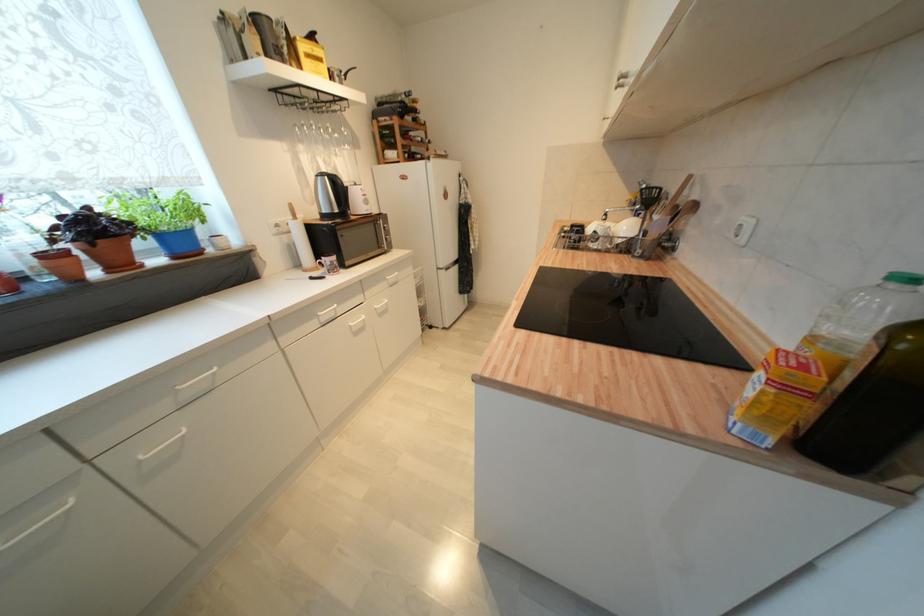
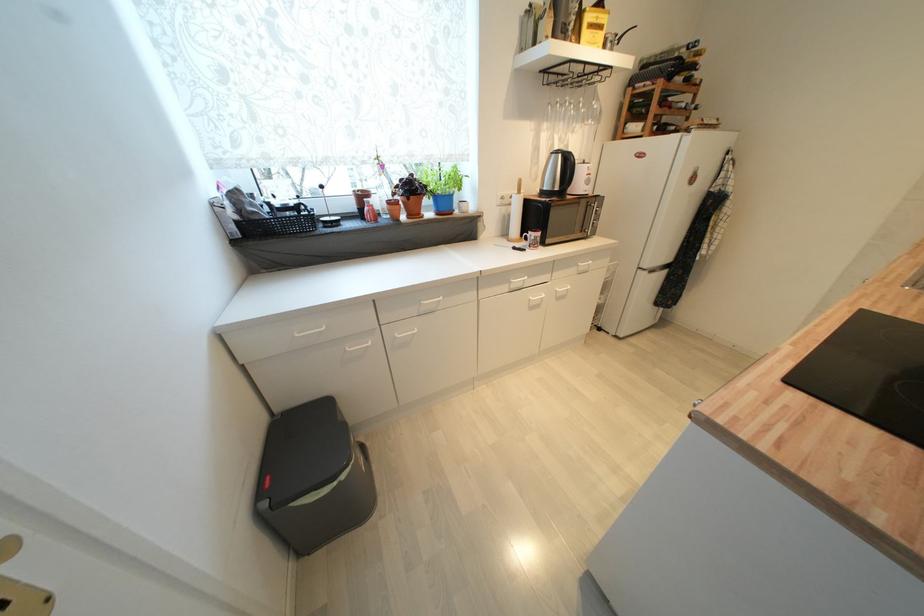
Where in the second image is the point corresponding to point (409, 145) from the first image?

(664, 114)